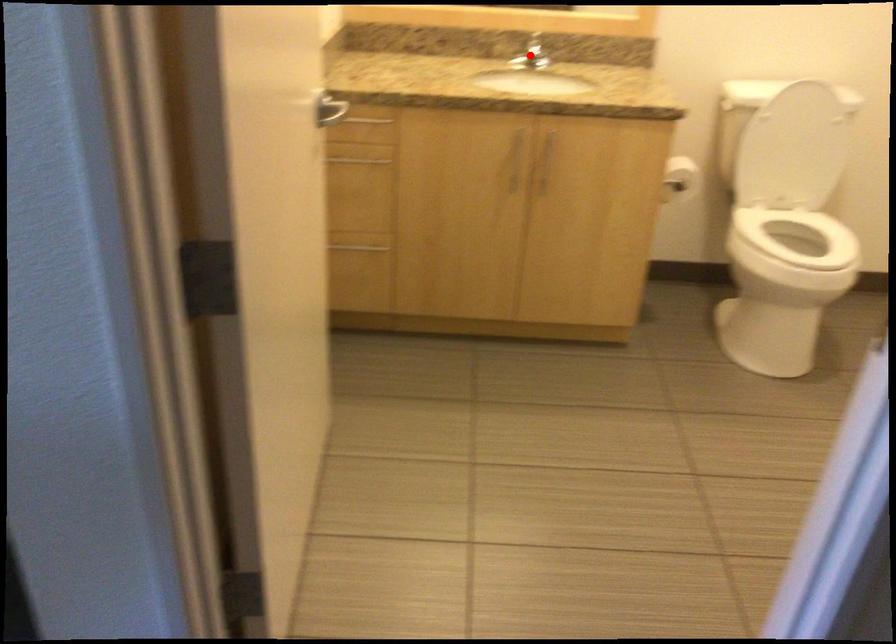
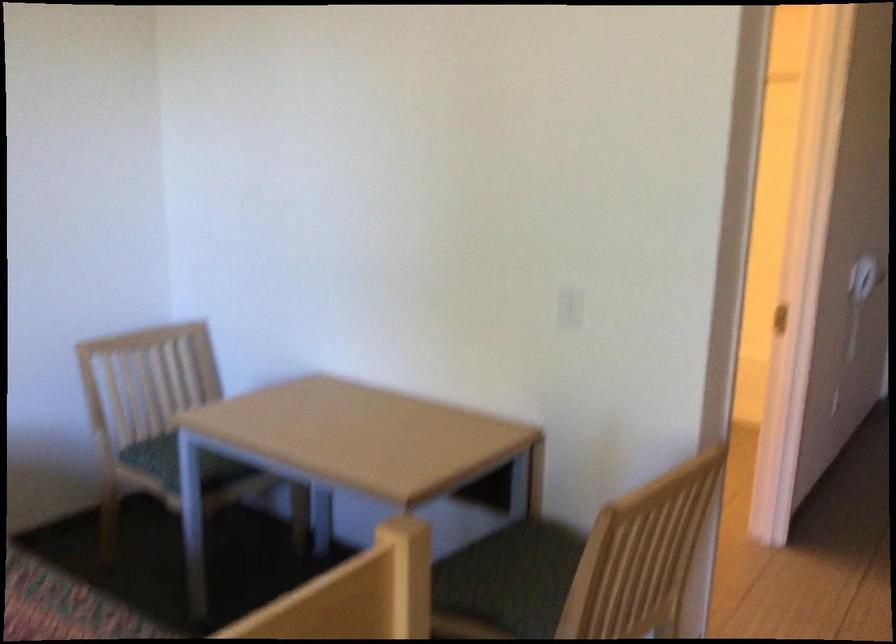
Question: I am providing you with two images of the same scene from different viewpoints. A red point is marked on the first image. Is the red point's position out of view in image 2?

Choices:
 (A) Yes
 (B) No

Answer: (A)